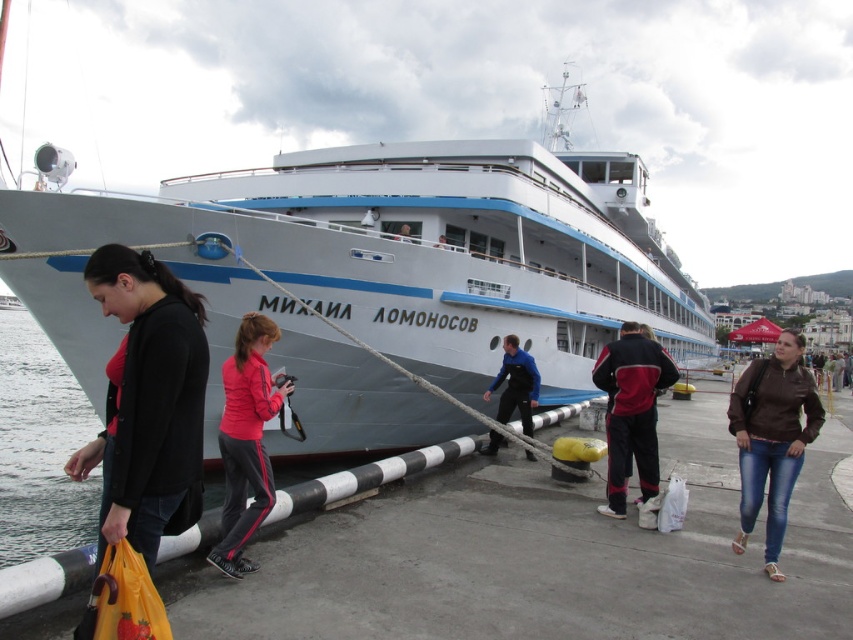
Does white glossy ship at center appear on the left side of brown leather jacket at lower right?

In fact, white glossy ship at center is to the right of brown leather jacket at lower right.

Which of these two, white glossy ship at center or brown leather jacket at lower right, stands shorter?

brown leather jacket at lower right is shorter.

Does point (550, 241) come in front of point (744, 492)?

No.

This screenshot has height=640, width=853. In order to click on white glossy ship at center in this screenshot , I will do `click(380, 275)`.

Does matte black jacket at lower left appear on the left side of brown leather jacket at lower right?

Correct, you'll find matte black jacket at lower left to the left of brown leather jacket at lower right.

Which is behind, point (91, 268) or point (751, 364)?

Positioned behind is point (751, 364).

Where is `matte black jacket at lower left`? The image size is (853, 640). matte black jacket at lower left is located at coordinates (148, 403).

Is white glossy ship at center thinner than blue smooth jacket at center?

No, white glossy ship at center is not thinner than blue smooth jacket at center.

Who is lower down, white glossy ship at center or blue smooth jacket at center?

blue smooth jacket at center is below.

Who is more forward, (354, 324) or (521, 420)?

Point (521, 420) is more forward.

You are a GUI agent. You are given a task and a screenshot of the screen. Output one action in this format:
    pyautogui.click(x=<x>, y=<y>)
    Task: Click on the white glossy ship at center
    
    Given the screenshot: What is the action you would take?
    pyautogui.click(x=380, y=275)